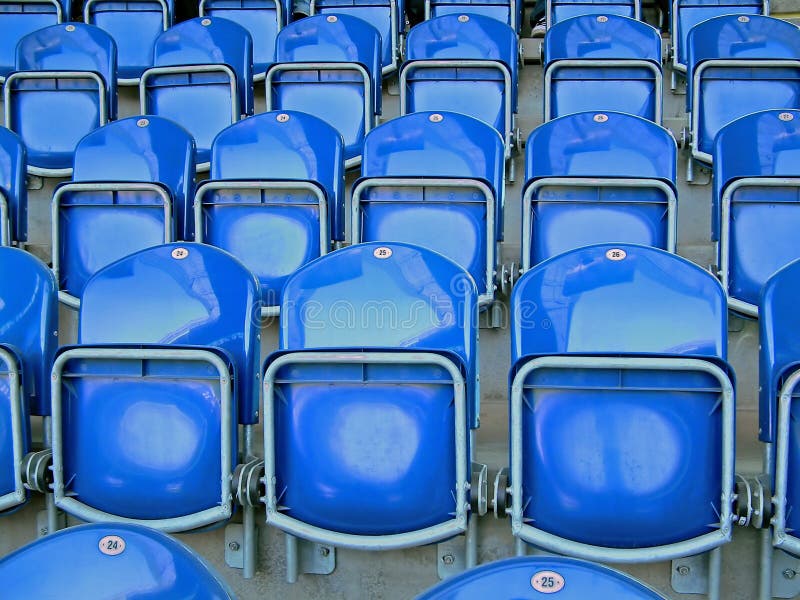
In order to click on blue seats on right side of photo in this screenshot , I will do `click(786, 384)`, `click(770, 222)`, `click(738, 67)`, `click(694, 15)`.